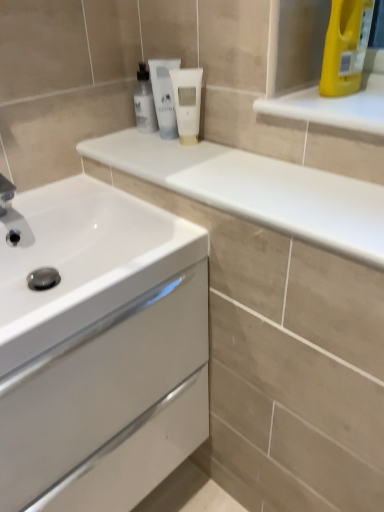
How much space does white matte tube at center, which appears as the second mouthwash when viewed from the right, occupy vertically?

white matte tube at center, which appears as the second mouthwash when viewed from the right, is 19.47 centimeters in height.

The height and width of the screenshot is (512, 384). In order to click on white glossy countertop at upper center in this screenshot , I will do `click(256, 189)`.

The image size is (384, 512). What do you see at coordinates (100, 348) in the screenshot?
I see `white glossy cabinet at lower left` at bounding box center [100, 348].

Measure the distance between point (163, 467) and camera.

Point (163, 467) is 3.51 feet from camera.

At what (x,y) coordinates should I click in order to perform the action: click on white glossy mouthwash at upper center, the 3th mouthwash from the right. Please return your answer as a coordinate pair (x, y). Looking at the image, I should click on (144, 102).

The height and width of the screenshot is (512, 384). I want to click on white matte tube at center, the first mouthwash from the right, so click(187, 102).

In order to click on brushed metal faucet at left in this screenshot , I will do `click(13, 217)`.

The image size is (384, 512). In order to click on white matte tube at center, acting as the 2th mouthwash starting from the left in this screenshot , I will do `click(164, 95)`.

Identify the location of cleaning product that appears above the brushed metal faucet at left (from a real-world perspective). (345, 47).

Is brushed metal faucet at left behind yellow plastic bottle at upper right?

Yes.

Who is taller, brushed metal faucet at left or yellow plastic bottle at upper right?

yellow plastic bottle at upper right is taller.

Are brushed metal faucet at left and yellow plastic bottle at upper right located far from each other?

No, brushed metal faucet at left is not far from yellow plastic bottle at upper right.

Considering the relative positions of white glossy mouthwash at upper center, acting as the 1th mouthwash starting from the left, and white glossy cabinet at lower left in the image provided, is white glossy mouthwash at upper center, acting as the 1th mouthwash starting from the left, to the left or to the right of white glossy cabinet at lower left?

In the image, white glossy mouthwash at upper center, acting as the 1th mouthwash starting from the left, appears on the right side of white glossy cabinet at lower left.

How different are the orientations of white glossy mouthwash at upper center, the 3th mouthwash from the right, and white glossy cabinet at lower left in degrees?

The angle between the facing direction of white glossy mouthwash at upper center, the 3th mouthwash from the right, and the facing direction of white glossy cabinet at lower left is 89.7 degrees.

How much distance is there between white glossy mouthwash at upper center, acting as the 1th mouthwash starting from the left, and white glossy cabinet at lower left?

white glossy mouthwash at upper center, acting as the 1th mouthwash starting from the left, is 22.63 inches from white glossy cabinet at lower left.

Based on the photo, is white glossy mouthwash at upper center, the 3th mouthwash from the right, far from white glossy cabinet at lower left?

white glossy mouthwash at upper center, the 3th mouthwash from the right, is near white glossy cabinet at lower left, not far away.

In the scene shown: Which of these two, white matte tube at center, marked as the third mouthwash in a left-to-right arrangement, or white glossy cabinet at lower left, is wider?

Wider between the two is white glossy cabinet at lower left.

Consider the image. Which is more to the right, white matte tube at center, marked as the third mouthwash in a left-to-right arrangement, or white glossy cabinet at lower left?

From the viewer's perspective, white matte tube at center, marked as the third mouthwash in a left-to-right arrangement, appears more on the right side.

From the image's perspective, does white matte tube at center, the first mouthwash from the right, appear lower than white glossy cabinet at lower left?

No, from the image's perspective, white matte tube at center, the first mouthwash from the right, is not below white glossy cabinet at lower left.

Would you say white matte tube at center, marked as the third mouthwash in a left-to-right arrangement, is inside or outside white glossy cabinet at lower left?

The correct answer is: outside.

Is white glossy cabinet at lower left facing away from white glossy mouthwash at upper center, acting as the 1th mouthwash starting from the left?

white glossy cabinet at lower left does not have its back to white glossy mouthwash at upper center, acting as the 1th mouthwash starting from the left.

Is the surface of white glossy cabinet at lower left in direct contact with white glossy mouthwash at upper center, the 3th mouthwash from the right?

white glossy cabinet at lower left and white glossy mouthwash at upper center, the 3th mouthwash from the right, are clearly separated.

Consider the image. Would you say white glossy mouthwash at upper center, acting as the 1th mouthwash starting from the left, is part of white glossy cabinet at lower left's contents?

No, white glossy mouthwash at upper center, acting as the 1th mouthwash starting from the left, is located outside of white glossy cabinet at lower left.

What are the coordinates of `bathroom cabinet that appears below the white matte tube at center, marked as the third mouthwash in a left-to-right arrangement (from a real-world perspective)` in the screenshot? It's located at (100, 348).

Is white glossy cabinet at lower left not close to white matte tube at center, marked as the third mouthwash in a left-to-right arrangement?

No, white glossy cabinet at lower left is in close proximity to white matte tube at center, marked as the third mouthwash in a left-to-right arrangement.

Is white glossy cabinet at lower left aimed at white matte tube at center, the first mouthwash from the right?

No.

Based on the photo, from a real-world perspective, which object rests below the other?

In real-world perspective, white glossy cabinet at lower left is lower.

Is brushed metal faucet at left directly adjacent to white matte tube at center, the first mouthwash from the right?

No.

Is brushed metal faucet at left turned away from white matte tube at center, marked as the third mouthwash in a left-to-right arrangement?

brushed metal faucet at left is not turned away from white matte tube at center, marked as the third mouthwash in a left-to-right arrangement.

From a real-world perspective, between brushed metal faucet at left and white matte tube at center, the first mouthwash from the right, who is vertically lower?

From a 3D spatial view, brushed metal faucet at left is below.

Starting from the brushed metal faucet at left, which mouthwash is the 3rd one to the right? Please provide its 2D coordinates.

[(187, 102)]

Is yellow plastic bottle at upper right further to camera compared to brushed metal faucet at left?

That is False.

From the image's perspective, relative to brushed metal faucet at left, is yellow plastic bottle at upper right above or below?

yellow plastic bottle at upper right is above brushed metal faucet at left.

Considering the relative sizes of yellow plastic bottle at upper right and brushed metal faucet at left in the image provided, is yellow plastic bottle at upper right thinner than brushed metal faucet at left?

Indeed, yellow plastic bottle at upper right has a lesser width compared to brushed metal faucet at left.

Find the location of a particular element. The width and height of the screenshot is (384, 512). plumbing fixture below the yellow plastic bottle at upper right (from the image's perspective) is located at coordinates (13, 217).

Starting from the white glossy cabinet at lower left, which mouthwash is the 1st one to the right? Please provide its 2D coordinates.

[(144, 102)]

Looking at the image, which one is located closer to white glossy cabinet at lower left, white glossy mouthwash at upper center, the 3th mouthwash from the right, or white matte tube at center, marked as the third mouthwash in a left-to-right arrangement?

white matte tube at center, marked as the third mouthwash in a left-to-right arrangement, is positioned closer to the anchor white glossy cabinet at lower left.

Estimate the real-world distances between objects in this image. Which object is closer to brushed metal faucet at left, white matte tube at center, marked as the third mouthwash in a left-to-right arrangement, or yellow plastic bottle at upper right?

Based on the image, white matte tube at center, marked as the third mouthwash in a left-to-right arrangement, appears to be nearer to brushed metal faucet at left.

When comparing their distances from yellow plastic bottle at upper right, does white matte tube at center, which appears as the second mouthwash when viewed from the right, or white matte tube at center, marked as the third mouthwash in a left-to-right arrangement, seem closer?

white matte tube at center, marked as the third mouthwash in a left-to-right arrangement, lies closer to yellow plastic bottle at upper right than the other object.

Which object lies further to the anchor point white matte tube at center, the first mouthwash from the right, yellow plastic bottle at upper right or white matte tube at center, which appears as the second mouthwash when viewed from the right?

yellow plastic bottle at upper right.

When comparing their distances from white glossy mouthwash at upper center, acting as the 1th mouthwash starting from the left, does yellow plastic bottle at upper right or white glossy cabinet at lower left seem further?

white glossy cabinet at lower left lies further to white glossy mouthwash at upper center, acting as the 1th mouthwash starting from the left, than the other object.

When comparing their distances from white glossy cabinet at lower left, does white matte tube at center, the first mouthwash from the right, or white glossy countertop at upper center seem closer?

white glossy countertop at upper center.

Which object lies further to the anchor point white matte tube at center, marked as the third mouthwash in a left-to-right arrangement, white glossy cabinet at lower left or brushed metal faucet at left?

white glossy cabinet at lower left lies further to white matte tube at center, marked as the third mouthwash in a left-to-right arrangement, than the other object.

Which object lies nearer to the anchor point white glossy mouthwash at upper center, acting as the 1th mouthwash starting from the left, white glossy cabinet at lower left or yellow plastic bottle at upper right?

yellow plastic bottle at upper right is closer to white glossy mouthwash at upper center, acting as the 1th mouthwash starting from the left.

What are the coordinates of `counter top that lies between white matte tube at center, marked as the third mouthwash in a left-to-right arrangement, and white glossy cabinet at lower left from top to bottom` in the screenshot? It's located at (256, 189).

Locate an element on the screen. plumbing fixture between white glossy countertop at upper center and white glossy cabinet at lower left from top to bottom is located at coordinates (13, 217).

At what (x,y) coordinates should I click in order to perform the action: click on cleaning product located between white glossy countertop at upper center and white matte tube at center, acting as the 2th mouthwash starting from the left, in the depth direction. Please return your answer as a coordinate pair (x, y). The height and width of the screenshot is (512, 384). Looking at the image, I should click on (345, 47).

In order to click on mouthwash between white matte tube at center, acting as the 2th mouthwash starting from the left, and yellow plastic bottle at upper right in this screenshot , I will do `click(187, 102)`.